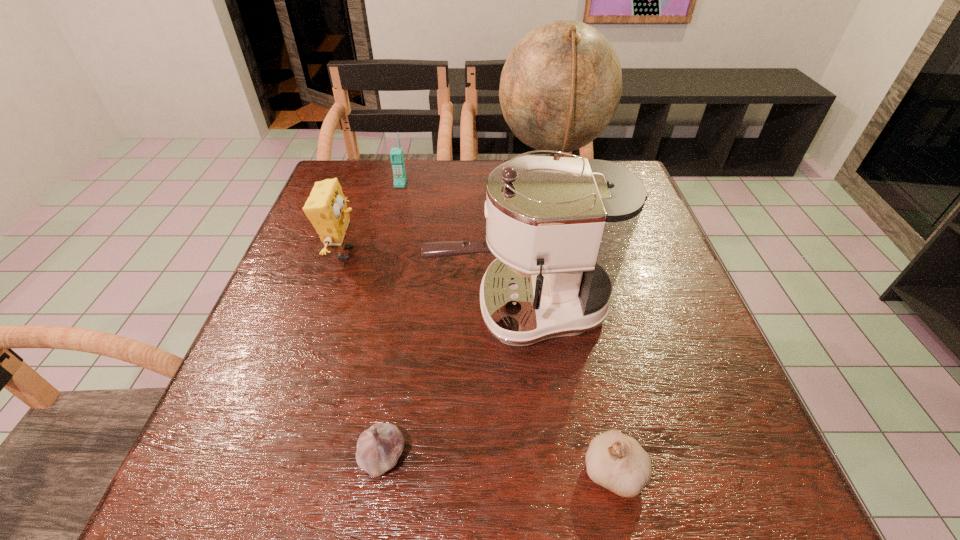
I want to click on object located in the far right corner section of the desktop, so click(x=560, y=87).

Locate an element on the screen. vacant space at the near edge is located at coordinates (492, 473).

At what (x,y) coordinates should I click in order to perform the action: click on vacant region at the left edge of the desktop. Please return your answer as a coordinate pair (x, y). Image resolution: width=960 pixels, height=540 pixels. Looking at the image, I should click on (289, 419).

In the image, there is a desktop. At what (x,y) coordinates should I click in order to perform the action: click on vacant space at the right edge. Please return your answer as a coordinate pair (x, y). The image size is (960, 540). Looking at the image, I should click on (654, 329).

You are a GUI agent. You are given a task and a screenshot of the screen. Output one action in this format:
    pyautogui.click(x=<x>, y=<y>)
    Task: Click on the empty space between the fourth object from right to left and the cellular telephone
    The image size is (960, 540).
    Given the screenshot: What is the action you would take?
    pyautogui.click(x=392, y=320)

Locate an element on the screen. The height and width of the screenshot is (540, 960). vacant space that is in between the tallest object and the second object from left to right is located at coordinates (474, 186).

Identify the location of vacant region between the tallest object and the left garlic. This screenshot has height=540, width=960. (466, 322).

The image size is (960, 540). Find the location of `unoccupied area between the right garlic and the coffee maker`. unoccupied area between the right garlic and the coffee maker is located at coordinates (566, 389).

Locate an element on the screen. The image size is (960, 540). free space that is in between the third object from left to right and the right garlic is located at coordinates (498, 463).

You are a GUI agent. You are given a task and a screenshot of the screen. Output one action in this format:
    pyautogui.click(x=<x>, y=<y>)
    Task: Click on the vacant space in between the globe and the left garlic
    This screenshot has width=960, height=540.
    Given the screenshot: What is the action you would take?
    coord(466,322)